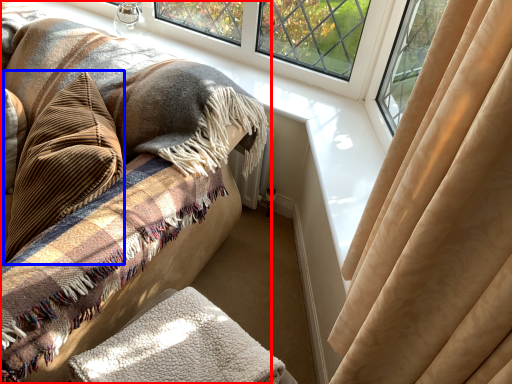
Question: Which point is closer to the camera, furniture (highlighted by a red box) or throw pillow (highlighted by a blue box)?

Choices:
 (A) furniture
 (B) throw pillow

Answer: (A)